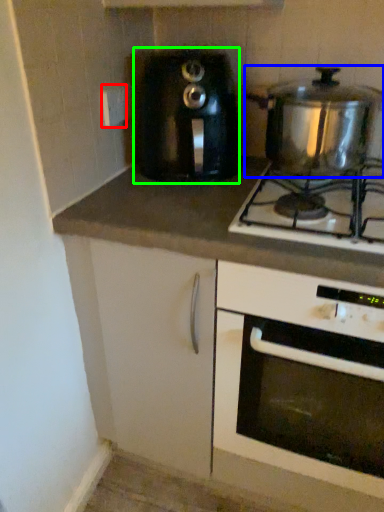
Question: Based on their relative distances, which object is nearer to electric outlet (highlighted by a red box)? Choose from kitchen appliance (highlighted by a blue box) and toaster (highlighted by a green box).

Choices:
 (A) kitchen appliance
 (B) toaster

Answer: (B)